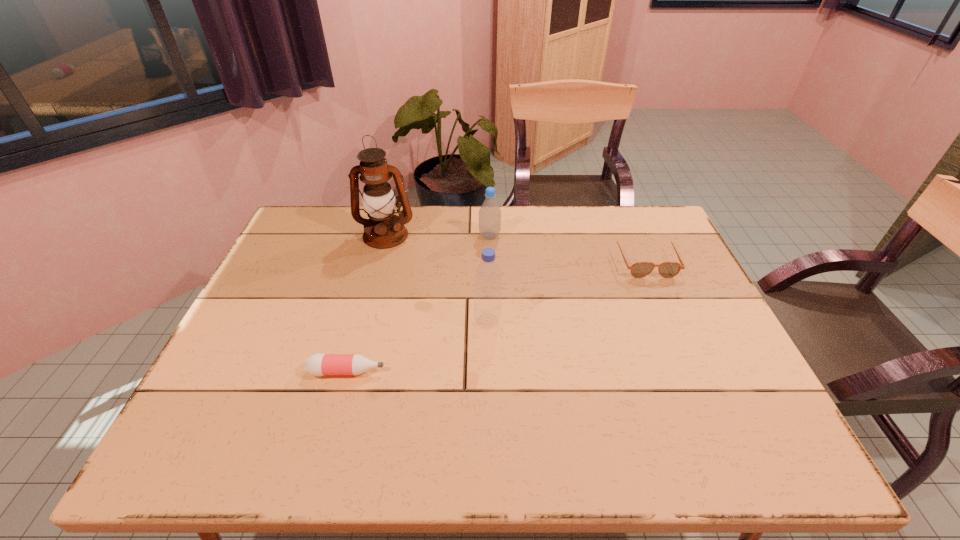
You are a GUI agent. You are given a task and a screenshot of the screen. Output one action in this format:
    pyautogui.click(x=<x>, y=<y>)
    Task: Click on the blank area located 0.190m on the left of the third shortest object
    Image resolution: width=960 pixels, height=540 pixels.
    Given the screenshot: What is the action you would take?
    pyautogui.click(x=420, y=236)

The width and height of the screenshot is (960, 540). Find the location of `free spot located on the front-facing side of the rightmost object`. free spot located on the front-facing side of the rightmost object is located at coordinates (699, 385).

Where is `free location located 0.400m with the cap open on the shortest bottle`? This screenshot has width=960, height=540. free location located 0.400m with the cap open on the shortest bottle is located at coordinates (558, 372).

Identify the location of lantern located at the far edge. This screenshot has width=960, height=540. (383, 230).

The image size is (960, 540). Find the location of `bottle present at the far edge`. bottle present at the far edge is located at coordinates (490, 213).

Locate an element on the screen. sunglasses that is at the far edge is located at coordinates (641, 269).

I want to click on object that is at the right edge, so click(641, 269).

The image size is (960, 540). Identify the location of object present at the far right corner. (641, 269).

Image resolution: width=960 pixels, height=540 pixels. Find the location of `vacant space at the far edge of the desktop`. vacant space at the far edge of the desktop is located at coordinates (521, 231).

The height and width of the screenshot is (540, 960). Find the location of `free point at the near edge`. free point at the near edge is located at coordinates (353, 463).